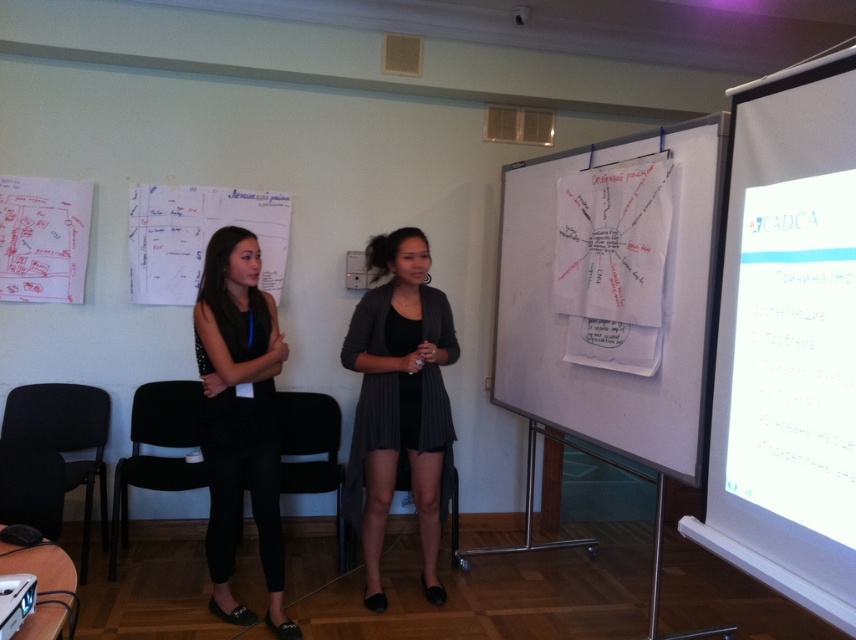
Question: Which point appears closest to the camera in this image?

Choices:
 (A) (750, 397)
 (B) (288, 470)

Answer: (A)

Question: Considering the relative positions of white paperboard at center and dark gray textured cardigan at center in the image provided, where is white paperboard at center located with respect to dark gray textured cardigan at center?

Choices:
 (A) below
 (B) above

Answer: (B)

Question: Is black plastic chair at lower left in front of black fabric chair at center?

Choices:
 (A) yes
 (B) no

Answer: (A)

Question: Which of these objects is positioned closest to the metallic projector at lower left?

Choices:
 (A) dark gray textured cardigan at center
 (B) black plastic chair at lower left

Answer: (A)

Question: Is the position of white glossy projection screen at right less distant than that of dark gray textured cardigan at center?

Choices:
 (A) no
 (B) yes

Answer: (B)

Question: Which of these objects is positioned closest to the dark gray textured cardigan at center?

Choices:
 (A) black matte dress at center
 (B) black plastic chair at lower left

Answer: (A)